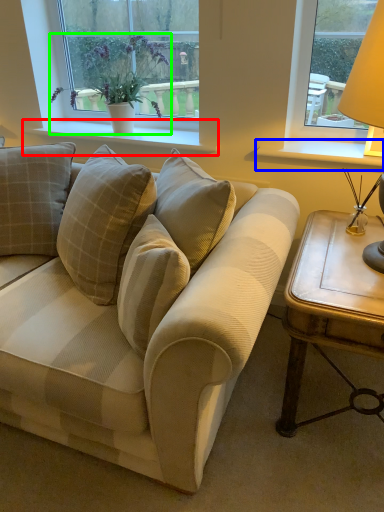
Question: Based on their relative distances, which object is farther from window sill (highlighted by a red box)? Choose from window sill (highlighted by a blue box) and houseplant (highlighted by a green box).

Choices:
 (A) window sill
 (B) houseplant

Answer: (A)